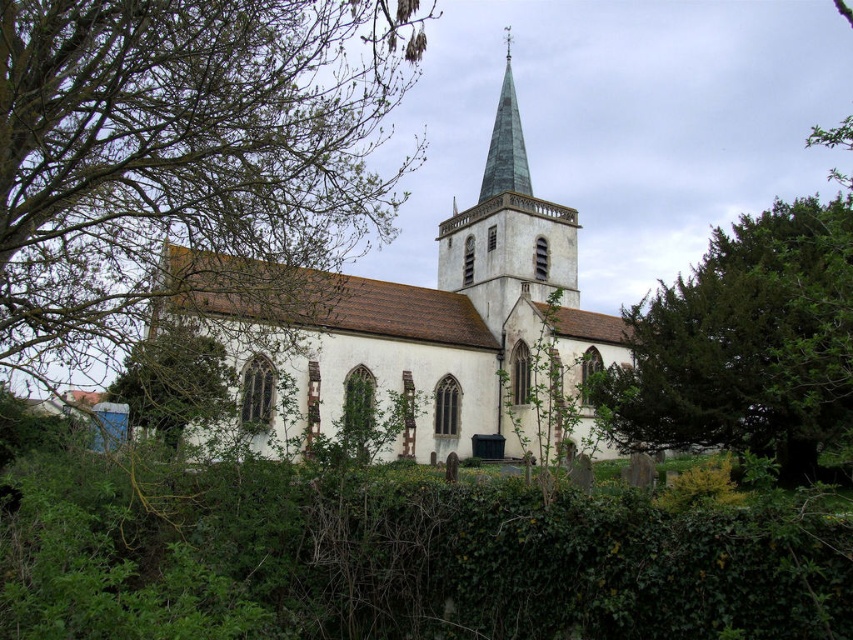
You are standing in front of the church and notice two points marked on its facade. Which of these points, point (508, 282) or point (509, 180), is closer to you?

Point (508, 282) is closer to the viewer than point (509, 180).

You are standing in front of the church and want to locate the green glass steeple at upper center. According to the coordinates provided, where exactly should you look?

The green glass steeple at upper center is located at coordinates point (508, 228).

You are an architect designing a new garden layout for the church. You need to place a new statue exactly halfway between the green glass steeple at upper center and the green leafy tree at lower left. Which object will the statue be closer to?

The statue will be closer to the green leafy tree at lower left because the green glass steeple at upper center is bigger than the green leafy tree at lower left, meaning the tree is smaller and thus the distance between them would require the midpoint to be nearer to the smaller object.